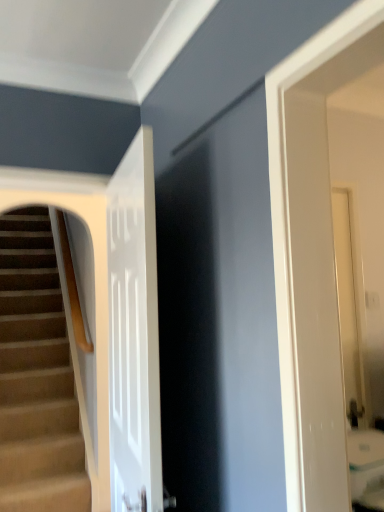
What do you see at coordinates (36, 376) in the screenshot? The width and height of the screenshot is (384, 512). I see `carpeted stairs at left` at bounding box center [36, 376].

Locate an element on the screen. carpeted stairs at left is located at coordinates (36, 376).

Describe the element at coordinates (134, 333) in the screenshot. I see `white glossy door at center` at that location.

This screenshot has width=384, height=512. I want to click on white glossy door at center, so click(x=134, y=333).

In order to click on carpeted stairs at left in this screenshot , I will do `click(36, 376)`.

Considering the positions of objects white glossy door at center and carpeted stairs at left in the image provided, who is more to the right, white glossy door at center or carpeted stairs at left?

Positioned to the right is white glossy door at center.

Which is behind, white glossy door at center or carpeted stairs at left?

carpeted stairs at left is further away from the camera.

Which is more distant, (108,185) or (58,301)?

The point (58,301) is farther from the camera.

From the image's perspective, is white glossy door at center positioned above or below carpeted stairs at left?

Based on their image positions, white glossy door at center is located above carpeted stairs at left.

From a real-world perspective, is white glossy door at center on top of carpeted stairs at left?

Yes, from a real-world perspective, white glossy door at center is on top of carpeted stairs at left.

Which object is thinner, white glossy door at center or carpeted stairs at left?

white glossy door at center.

Considering the sizes of objects white glossy door at center and carpeted stairs at left in the image provided, who is shorter, white glossy door at center or carpeted stairs at left?

white glossy door at center.

Considering the sizes of objects white glossy door at center and carpeted stairs at left in the image provided, who is bigger, white glossy door at center or carpeted stairs at left?

With larger size is carpeted stairs at left.

Which is correct: white glossy door at center is inside carpeted stairs at left, or outside of it?

white glossy door at center is spatially situated outside carpeted stairs at left.

Is white glossy door at center placed right next to carpeted stairs at left?

No.

Is white glossy door at center oriented away from carpeted stairs at left?

white glossy door at center is not turned away from carpeted stairs at left.

Measure the distance between white glossy door at center and carpeted stairs at left.

white glossy door at center and carpeted stairs at left are 6.35 feet apart.

I want to click on stairs on the left of white glossy door at center, so click(36, 376).

Considering the positions of objects carpeted stairs at left and white glossy door at center in the image provided, who is more to the left, carpeted stairs at left or white glossy door at center?

From the viewer's perspective, carpeted stairs at left appears more on the left side.

Considering the relative positions of carpeted stairs at left and white glossy door at center in the image provided, is carpeted stairs at left behind white glossy door at center?

Yes, carpeted stairs at left is further from the camera.

Which is less distant, (x=58, y=325) or (x=124, y=336)?

The point (x=124, y=336) is closer.

From the image's perspective, is carpeted stairs at left positioned above or below white glossy door at center?

carpeted stairs at left is situated lower than white glossy door at center in the image.

From a real-world perspective, is carpeted stairs at left physically located above or below white glossy door at center?

From a real-world perspective, carpeted stairs at left is physically below white glossy door at center.

Considering the relative sizes of carpeted stairs at left and white glossy door at center in the image provided, is carpeted stairs at left wider than white glossy door at center?

Indeed, carpeted stairs at left has a greater width compared to white glossy door at center.

Who is shorter, carpeted stairs at left or white glossy door at center?

white glossy door at center.

Looking at the image, does carpeted stairs at left seem bigger or smaller compared to white glossy door at center?

carpeted stairs at left is bigger than white glossy door at center.

Is carpeted stairs at left situated inside white glossy door at center or outside?

carpeted stairs at left is spatially situated outside white glossy door at center.

Is carpeted stairs at left directly adjacent to white glossy door at center?

carpeted stairs at left and white glossy door at center are not in contact.

Could you tell me if carpeted stairs at left is turned towards white glossy door at center?

Yes, carpeted stairs at left faces towards white glossy door at center.

Can you tell me how much carpeted stairs at left and white glossy door at center differ in facing direction?

carpeted stairs at left and white glossy door at center are facing 95.2 degrees away from each other.

Locate an element on the screen. This screenshot has width=384, height=512. door above the carpeted stairs at left (from the image's perspective) is located at coordinates (134, 333).

Where is `door above the carpeted stairs at left (from a real-world perspective)`? The width and height of the screenshot is (384, 512). door above the carpeted stairs at left (from a real-world perspective) is located at coordinates (134, 333).

Where is `door lying above the carpeted stairs at left (from the image's perspective)`? The height and width of the screenshot is (512, 384). door lying above the carpeted stairs at left (from the image's perspective) is located at coordinates (134, 333).